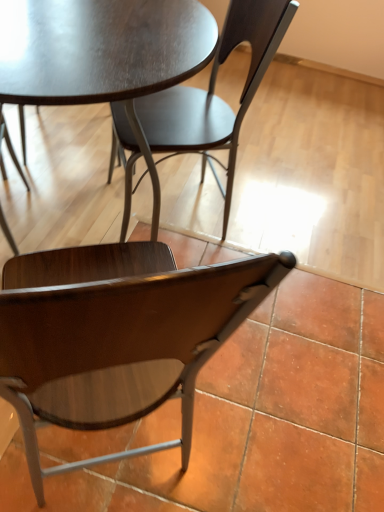
The height and width of the screenshot is (512, 384). Identify the location of free point below matte dark wood table at center (from a real-world perspective). (60, 198).